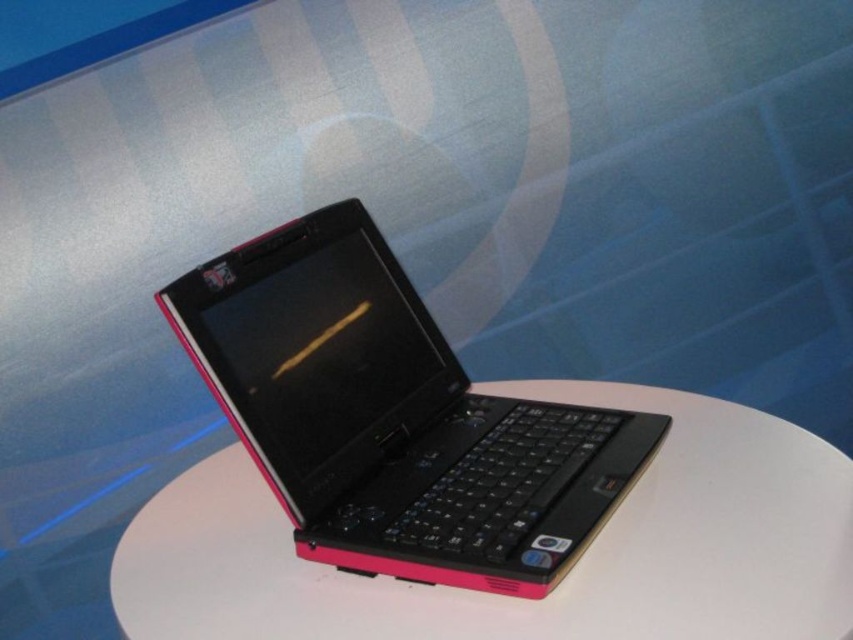
In the scene shown: Is pink plastic laptop at center in front of white matte round table at center?

No, it is not.

Describe the element at coordinates (393, 417) in the screenshot. I see `pink plastic laptop at center` at that location.

Locate an element on the screen. The image size is (853, 640). pink plastic laptop at center is located at coordinates (393, 417).